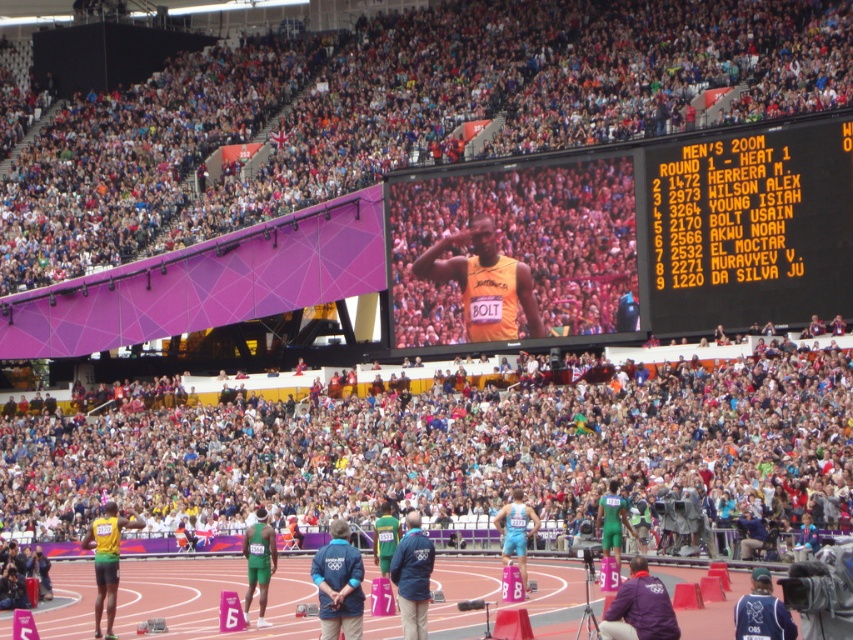
Question: Does blue fabric jacket at center appear on the right side of dark blue jersey at lower right?

Choices:
 (A) no
 (B) yes

Answer: (A)

Question: Which of the following is the closest to the observer?

Choices:
 (A) (354, 604)
 (B) (314, 156)
 (C) (762, 573)
 (D) (698, 177)

Answer: (C)

Question: Can you confirm if black plastic scoreboard at upper right is smaller than dark blue jersey at lower right?

Choices:
 (A) no
 (B) yes

Answer: (A)

Question: Which object is farther from the camera taking this photo?

Choices:
 (A) purple fabric jacket at lower right
 (B) blue fabric jacket at center
 (C) yellow-green jersey at center
 (D) light blue fabric shorts at center

Answer: (D)

Question: Can you confirm if orange fabric screen at center is positioned above blue fabric jacket at center?

Choices:
 (A) no
 (B) yes

Answer: (B)

Question: Which of these objects is positioned farthest from the orange fabric screen at center?

Choices:
 (A) blue fabric jacket at center
 (B) purple fabric jacket at lower right

Answer: (B)